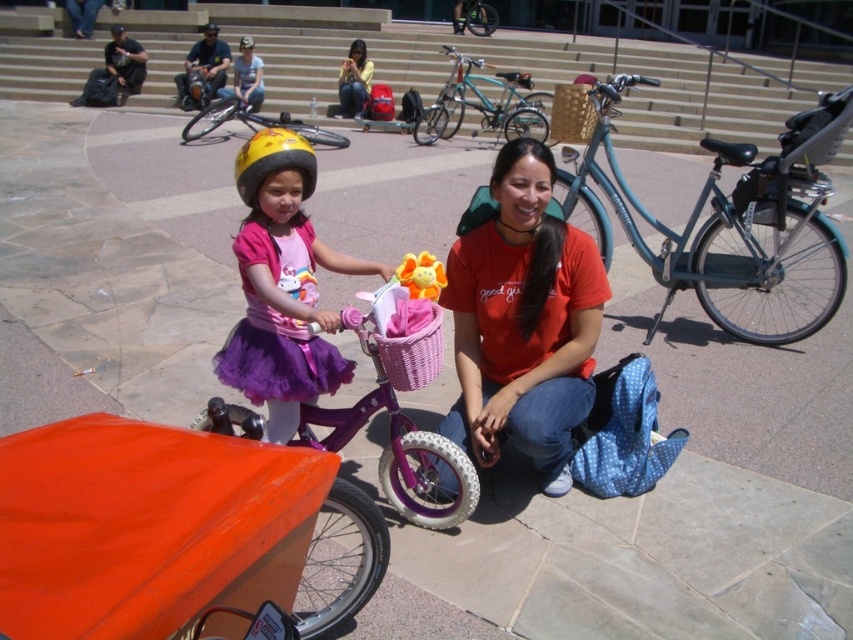
Question: Considering the relative positions of teal matte bicycle at center and denim jacket at upper center in the image provided, where is teal matte bicycle at center located with respect to denim jacket at upper center?

Choices:
 (A) left
 (B) right

Answer: (B)

Question: Is yellow matte helmet at center to the right of matte yellow helmet at upper center from the viewer's perspective?

Choices:
 (A) no
 (B) yes

Answer: (B)

Question: Which point is closer to the camera taking this photo?

Choices:
 (A) (566, 161)
 (B) (421, 330)
 (C) (367, 68)

Answer: (B)

Question: Based on their relative distances, which object is farther from the denim jacket at upper center?

Choices:
 (A) teal matte bicycle at center-right
 (B) plush yellow at center
 (C) yellow matte helmet at center
 (D) pink woven basket at center

Answer: (B)

Question: Which point is closer to the camera?

Choices:
 (A) (531, 88)
 (B) (402, 390)
 (C) (297, 134)

Answer: (B)

Question: Is matte pink bicycle at center bigger than plush yellow at center?

Choices:
 (A) yes
 (B) no

Answer: (A)